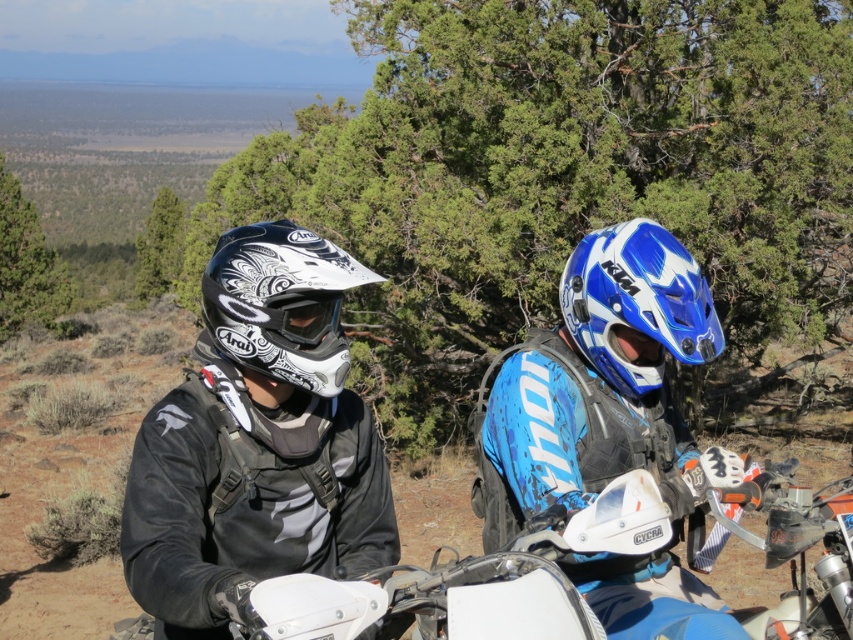
Consider the image. Which is more to the left, white matte helmet at center or blue glossy helmet at center?

white matte helmet at center

Is white matte helmet at center to the right of blue glossy helmet at center from the viewer's perspective?

In fact, white matte helmet at center is to the left of blue glossy helmet at center.

Between point (209, 273) and point (567, 284), which one is positioned behind?

Positioned behind is point (567, 284).

At what (x,y) coordinates should I click in order to perform the action: click on white matte helmet at center. Please return your answer as a coordinate pair (x, y). This screenshot has height=640, width=853. Looking at the image, I should click on [x=281, y=304].

Who is positioned more to the right, white matte motorcycle at center or white matte helmet at center?

From the viewer's perspective, white matte motorcycle at center appears more on the right side.

Does white matte motorcycle at center come behind white matte helmet at center?

Yes, it is.

The height and width of the screenshot is (640, 853). What do you see at coordinates (474, 580) in the screenshot? I see `white matte motorcycle at center` at bounding box center [474, 580].

At what (x,y) coordinates should I click in order to perform the action: click on white matte motorcycle at center. Please return your answer as a coordinate pair (x, y). The width and height of the screenshot is (853, 640). Looking at the image, I should click on (474, 580).

Does blue glossy helmet at center have a lesser width compared to matte white plastic goggles at center?

Incorrect, blue glossy helmet at center's width is not less than matte white plastic goggles at center's.

Is blue glossy helmet at center to the left of matte white plastic goggles at center from the viewer's perspective?

Incorrect, blue glossy helmet at center is not on the left side of matte white plastic goggles at center.

At what (x,y) coordinates should I click in order to perform the action: click on blue glossy helmet at center. Please return your answer as a coordinate pair (x, y). This screenshot has width=853, height=640. Looking at the image, I should click on (637, 301).